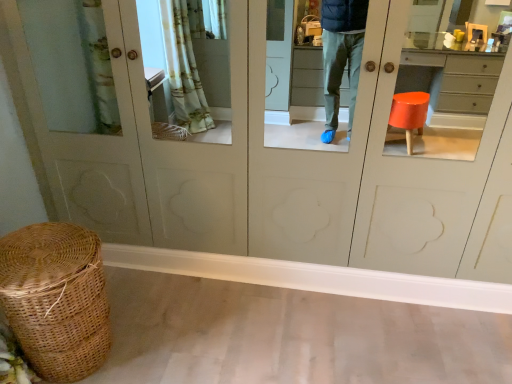
Locate an element on the screen. The height and width of the screenshot is (384, 512). free spot above woven brown basket at lower left (from a real-world perspective) is located at coordinates (38, 251).